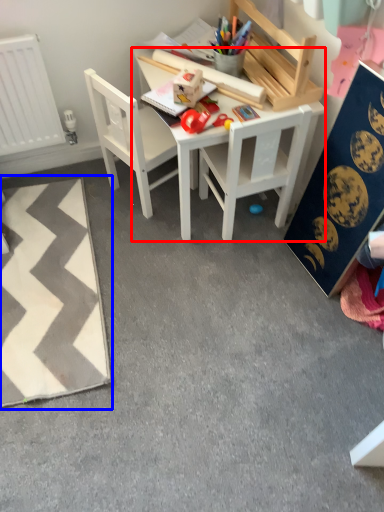
Question: Among these objects, which one is farthest to the camera, table (highlighted by a red box) or mat (highlighted by a blue box)?

Choices:
 (A) table
 (B) mat

Answer: (A)